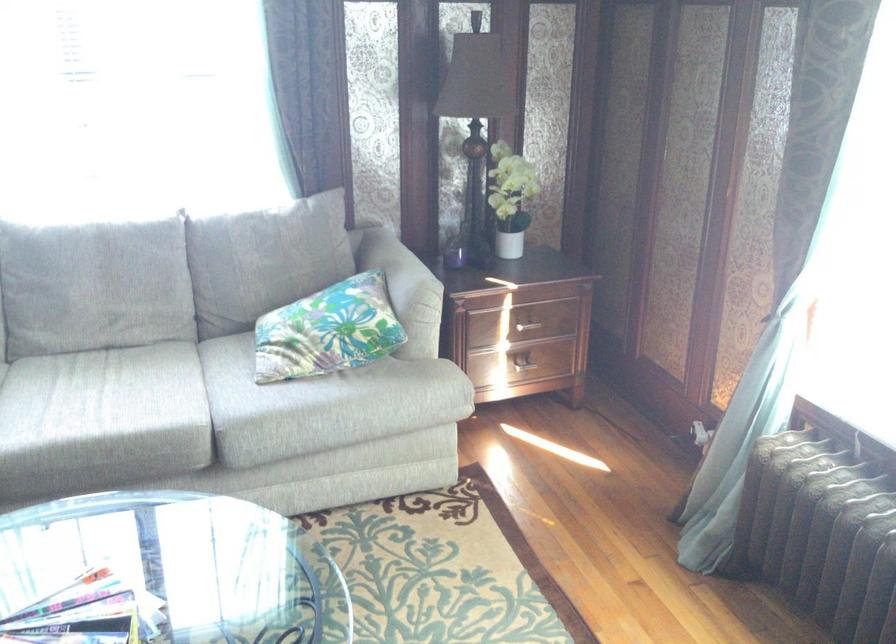
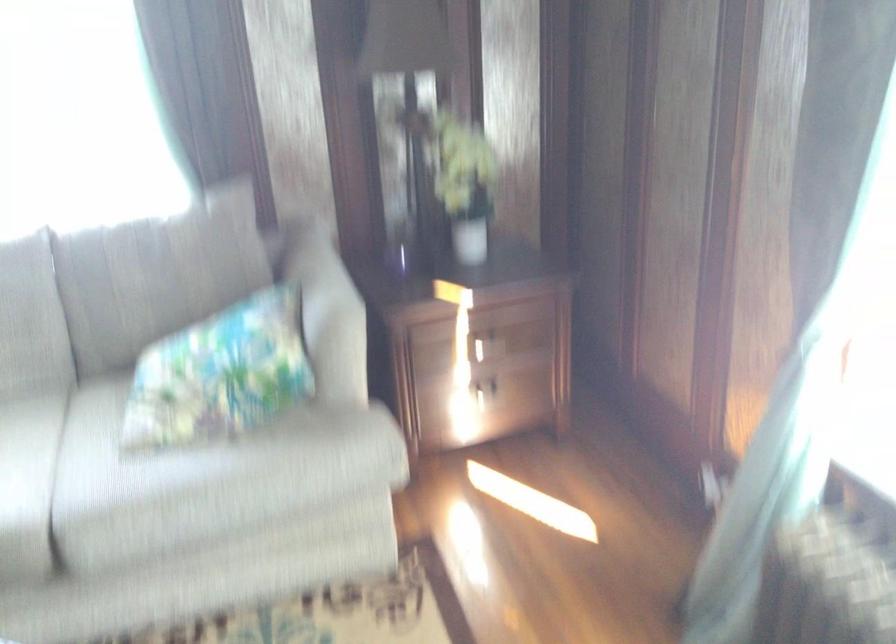
Find the pixel in the second image that matches pixel 225 382 in the first image.

(88, 448)